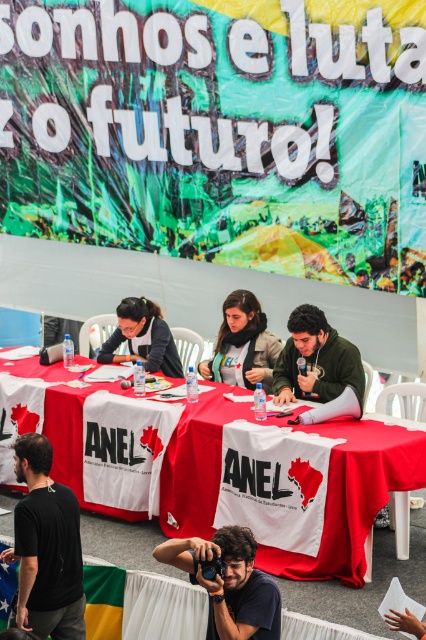
You are a photographer at the event and need to place your dark brown leather camera at lower center on the table next to the matte black jacket at center. Can the camera fit next to the jacket without overlapping?

The dark brown leather camera at lower center is shorter than the matte black jacket at center, so it should fit next to it without overlapping.

You are at a political event and need to move from your current position to the front of the room. There are two reference points marked as point 1 at coordinates (x=43, y=483) and point 2 at (x=233, y=326). Which point should you head towards to reach the front?

You should head towards point 1 at coordinates (x=43, y=483) because it is in front of point 2 at (x=233, y=326), meaning it is closer to the front of the room.

You are a photographer positioned at the front of the event. You need to capture a clear shot of both the black matte microphone at center and the green textured sweater at center. Since you can only focus on one object at a time, which object should you focus on to ensure the other remains in the background?

You should focus on the black matte microphone at center because it is closer to the viewer, allowing the green textured sweater at center to stay in the background.